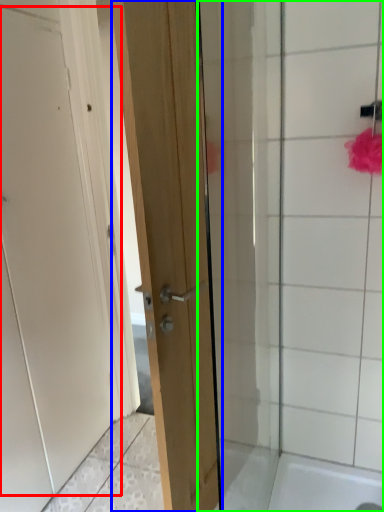
Question: Which object is positioned farthest from door (highlighted by a red box)? Select from door (highlighted by a blue box) and shower door (highlighted by a green box).

Choices:
 (A) door
 (B) shower door

Answer: (B)